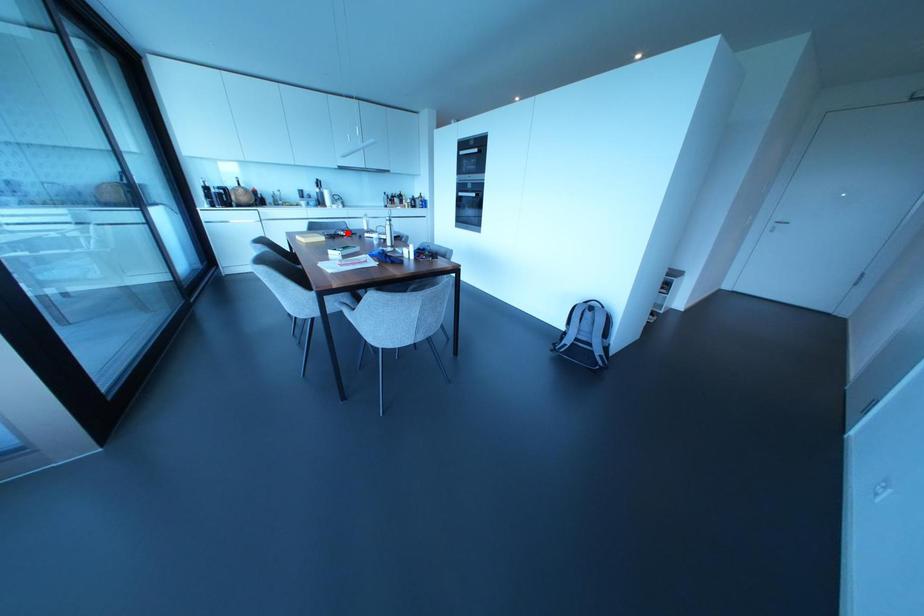
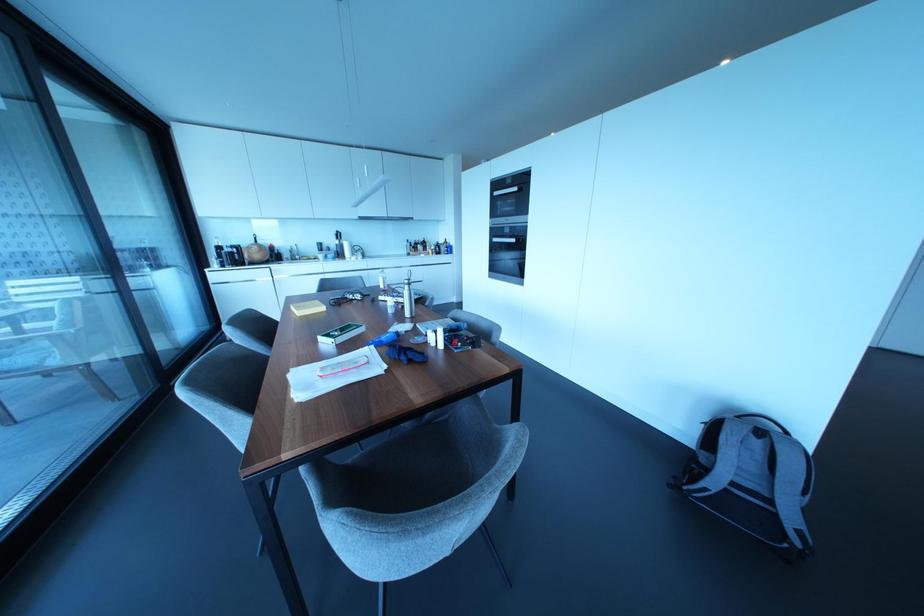
Locate, in the second image, the point that corresponds to the highlighted location in the first image.

(358, 296)